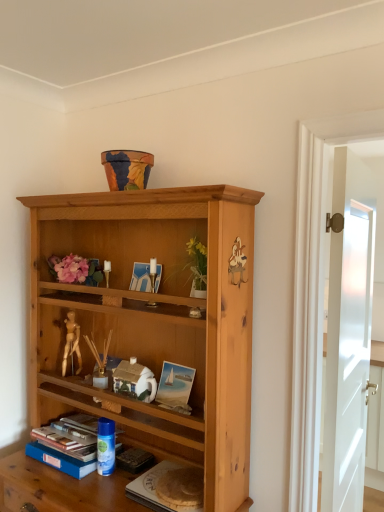
You are a GUI agent. You are given a task and a screenshot of the screen. Output one action in this format:
    pyautogui.click(x=<x>, y=<y>)
    Task: Click on the free space above hardcover book at lower center (from a real-world perspective)
    This screenshot has height=512, width=384.
    Given the screenshot: What is the action you would take?
    pyautogui.click(x=182, y=475)